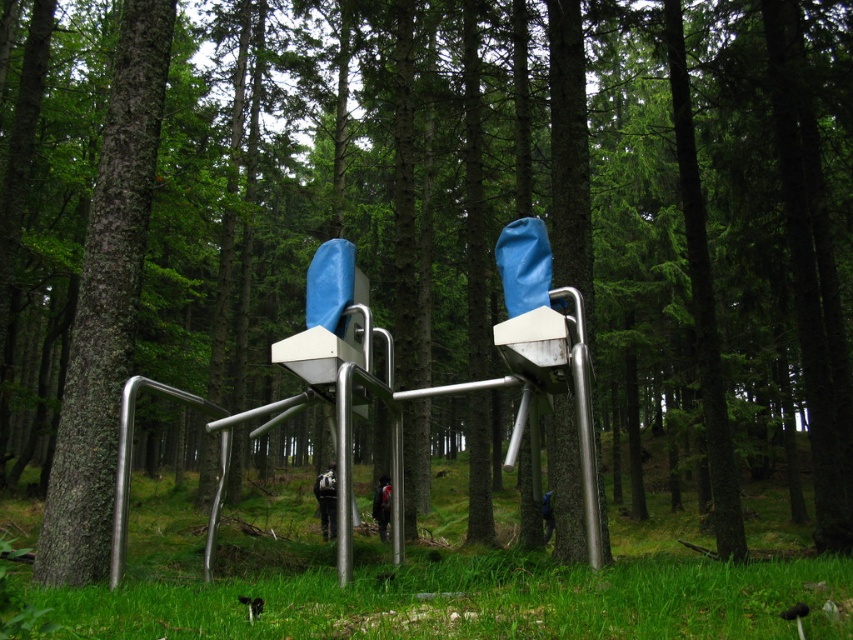
Which is more to the right, green grass at center or smooth brown tree trunk at left?

From the viewer's perspective, green grass at center appears more on the right side.

Between green grass at center and smooth brown tree trunk at left, which one has more height?

green grass at center

What do you see at coordinates (433, 584) in the screenshot? I see `green grass at center` at bounding box center [433, 584].

Where is `green grass at center`? The width and height of the screenshot is (853, 640). green grass at center is located at coordinates (433, 584).